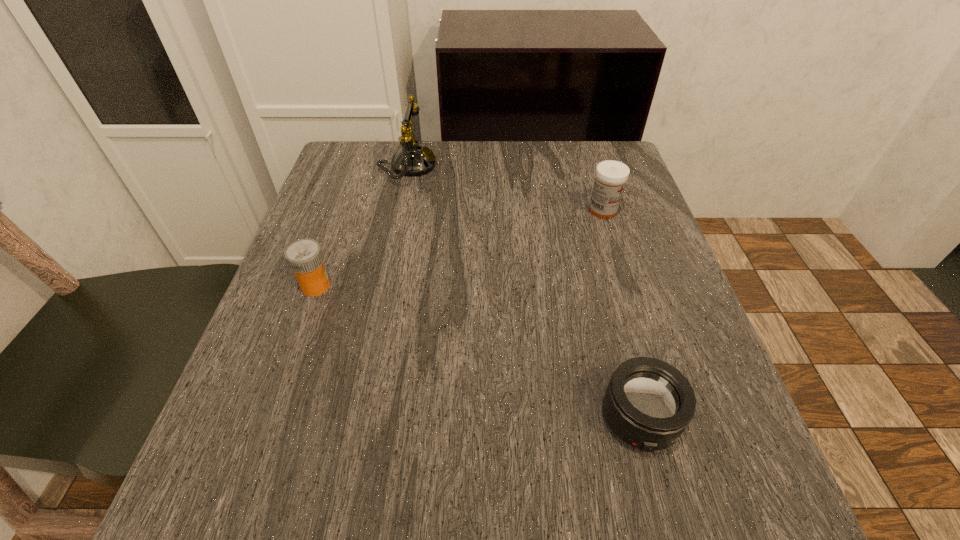
The width and height of the screenshot is (960, 540). Identify the location of free region that satisfies the following two spatial constraints: 1. on the front side of the taller medicine; 2. on the label side of the left medicine. (627, 286).

You are a GUI agent. You are given a task and a screenshot of the screen. Output one action in this format:
    pyautogui.click(x=<x>, y=<y>)
    Task: Click on the vacant space that satisfies the following two spatial constraints: 1. on the dial of the right medicine; 2. on the left side of the tallest object
    The image size is (960, 540).
    Given the screenshot: What is the action you would take?
    pyautogui.click(x=398, y=211)

Identify the location of vacant region that satisfies the following two spatial constraints: 1. on the front side of the second tallest object; 2. on the label side of the second shortest object. The height and width of the screenshot is (540, 960). (627, 286).